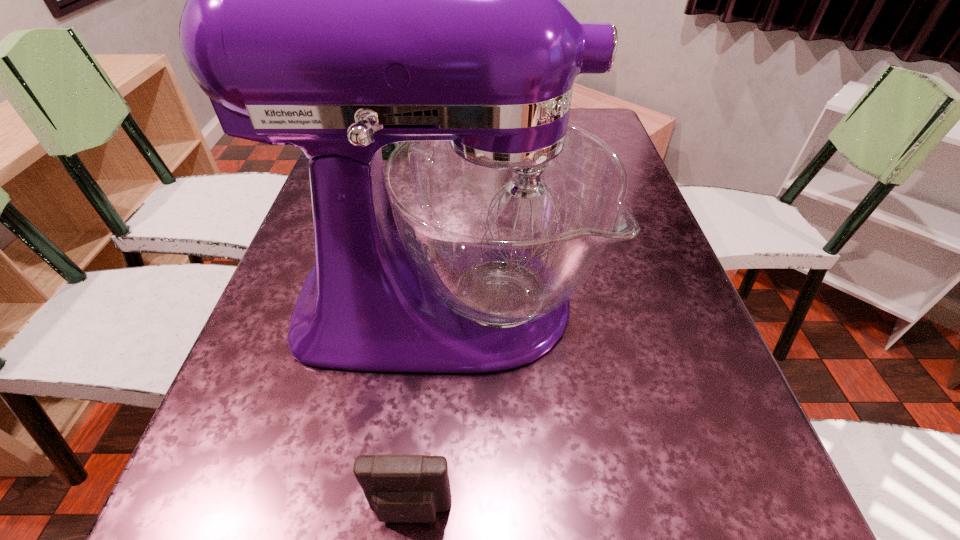
Locate an element on the screen. mixer situated at the left edge is located at coordinates (338, 0).

You are a GUI agent. You are given a task and a screenshot of the screen. Output one action in this format:
    pyautogui.click(x=<x>, y=<y>)
    Task: Click on the parakeet present at the left edge
    This screenshot has height=540, width=960.
    Given the screenshot: What is the action you would take?
    pyautogui.click(x=387, y=150)

This screenshot has width=960, height=540. I want to click on object present at the far left corner, so click(x=387, y=150).

This screenshot has height=540, width=960. I want to click on blank area at the right edge, so click(719, 394).

Where is `free space between the nearest object and the second farthest object`? The width and height of the screenshot is (960, 540). free space between the nearest object and the second farthest object is located at coordinates (427, 408).

Select which object appears as the second closest to the shortest object. Please provide its 2D coordinates. Your answer should be formatted as a tuple, i.e. [(x, y)], where the tuple contains the x and y coordinates of a point satisfying the conditions above.

[(387, 150)]

Identify which object is the closest to the second farthest object. Please provide its 2D coordinates. Your answer should be formatted as a tuple, i.e. [(x, y)], where the tuple contains the x and y coordinates of a point satisfying the conditions above.

[(410, 488)]

Identify the location of vacant area in the image that satisfies the following two spatial constraints: 1. at the bowl opening of the tallest object; 2. with an open flap on the nearest object. The height and width of the screenshot is (540, 960). (428, 511).

I want to click on blank space that satisfies the following two spatial constraints: 1. at the bowl opening of the tallest object; 2. with an open flap on the nearest object, so click(428, 511).

I want to click on free space that satisfies the following two spatial constraints: 1. at the bowl opening of the second farthest object; 2. with an open flap on the shortest object, so click(428, 511).